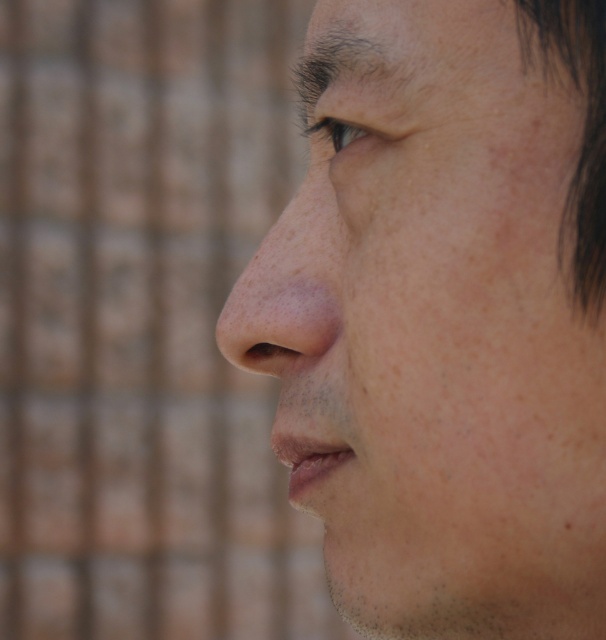
From the picture: You are an artist sketching the face in the image. You want to draw the point at point [379,365] first, then the point at point [347,145]. Which point will be closer to the viewer after you finish drawing?

Point [379,365] is in front of point [347,145], so the point at point [379,365] will be closer to the viewer.

You are holding a small drone that is 10 centimeters wide. You want to fly it from your current position to the point at coordinates point (215, 336) in the image. The camera is positioned to capture the scene. Can the drone safely reach the point without colliding with any objects in the image?

The point (215, 336) is 89.64 centimeters away from the camera. Since the drone is only 10 centimeters wide, it can safely travel the distance as there are no obstacles mentioned in the scene description between the camera and the point.

You are a photographer adjusting the focus on a camera. You notice two points in the frame at coordinates point (308, 221) and point (339, 132). If you want to focus on the point that is closer to the camera, which coordinate should you adjust the focus to?

Point (339, 132) is closer to the camera than point (308, 221), so you should adjust the focus to point (339, 132).